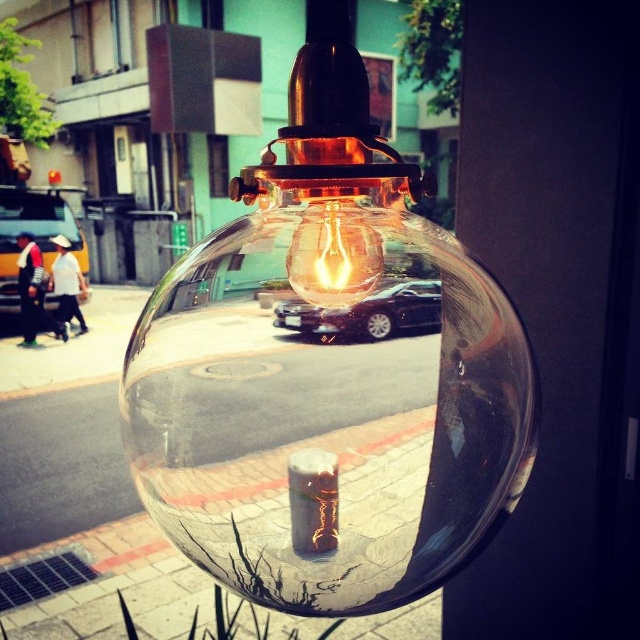
Question: Which of the following is the farthest from the observer?

Choices:
 (A) translucent glass bulb at center
 (B) transparent glass globe at center

Answer: (A)

Question: Which point is closer to the camera?

Choices:
 (A) translucent glass bulb at center
 (B) transparent glass globe at center

Answer: (B)

Question: From the image, what is the correct spatial relationship of transparent glass globe at center in relation to translucent glass bulb at center?

Choices:
 (A) right
 (B) left

Answer: (B)

Question: Is transparent glass globe at center to the left of translucent glass bulb at center from the viewer's perspective?

Choices:
 (A) yes
 (B) no

Answer: (A)

Question: Can you confirm if transparent glass globe at center is wider than translucent glass bulb at center?

Choices:
 (A) no
 (B) yes

Answer: (B)

Question: Which of the following is the closest to the observer?

Choices:
 (A) translucent glass bulb at center
 (B) transparent glass globe at center

Answer: (B)